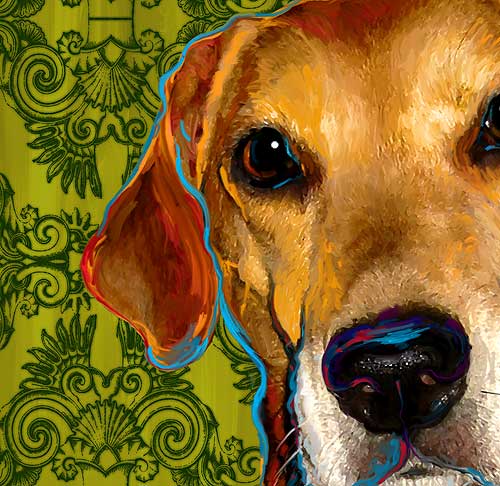
I want to click on art, so click(x=234, y=249).